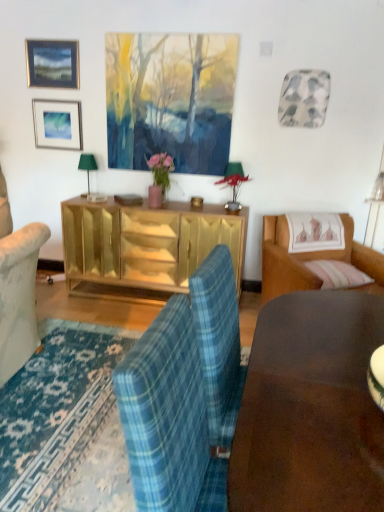
Question: Does matte black picture frame at upper left, the 2th picture frame from the bottom, have a lesser height compared to matte silver picture frame at upper left, marked as the 1th picture frame in a bottom-to-top arrangement?

Choices:
 (A) yes
 (B) no

Answer: (A)

Question: Would you say matte silver picture frame at upper left, marked as the 1th picture frame in a bottom-to-top arrangement, is part of matte black picture frame at upper left, the 2th picture frame from the bottom,'s contents?

Choices:
 (A) no
 (B) yes

Answer: (A)

Question: Does matte black picture frame at upper left, placed as the first picture frame when sorted from top to bottom, appear on the left side of matte silver picture frame at upper left, marked as the 1th picture frame in a bottom-to-top arrangement?

Choices:
 (A) no
 (B) yes

Answer: (A)

Question: Are matte black picture frame at upper left, the 2th picture frame from the bottom, and matte silver picture frame at upper left, placed as the 2th picture frame when sorted from top to bottom, far apart?

Choices:
 (A) no
 (B) yes

Answer: (A)

Question: From the image's perspective, is matte black picture frame at upper left, the 2th picture frame from the bottom, above matte silver picture frame at upper left, placed as the 2th picture frame when sorted from top to bottom?

Choices:
 (A) yes
 (B) no

Answer: (A)

Question: Considering the positions of brown leather couch at right and gold mirrored cabinet at center in the image, is brown leather couch at right bigger or smaller than gold mirrored cabinet at center?

Choices:
 (A) small
 (B) big

Answer: (B)

Question: Is brown leather couch at right taller or shorter than gold mirrored cabinet at center?

Choices:
 (A) tall
 (B) short

Answer: (B)

Question: From a real-world perspective, is brown leather couch at right physically located above or below gold mirrored cabinet at center?

Choices:
 (A) below
 (B) above

Answer: (B)

Question: In terms of width, does brown leather couch at right look wider or thinner when compared to gold mirrored cabinet at center?

Choices:
 (A) thin
 (B) wide

Answer: (B)

Question: Does point (107, 203) appear closer or farther from the camera than point (72, 111)?

Choices:
 (A) farther
 (B) closer

Answer: (B)

Question: Is gold mirrored cabinet at center inside the boundaries of matte silver picture frame at upper left, placed as the 2th picture frame when sorted from top to bottom, or outside?

Choices:
 (A) inside
 (B) outside

Answer: (B)

Question: Is gold mirrored cabinet at center bigger or smaller than matte silver picture frame at upper left, marked as the 1th picture frame in a bottom-to-top arrangement?

Choices:
 (A) big
 (B) small

Answer: (A)

Question: Visually, is gold mirrored cabinet at center positioned to the left or to the right of matte silver picture frame at upper left, placed as the 2th picture frame when sorted from top to bottom?

Choices:
 (A) left
 (B) right

Answer: (B)

Question: Is matte black picture frame at upper left, the 2th picture frame from the bottom, in front of or behind matte silver picture frame at upper left, marked as the 1th picture frame in a bottom-to-top arrangement, in the image?

Choices:
 (A) front
 (B) behind

Answer: (A)

Question: Is matte black picture frame at upper left, placed as the first picture frame when sorted from top to bottom, to the left or to the right of matte silver picture frame at upper left, placed as the 2th picture frame when sorted from top to bottom, in the image?

Choices:
 (A) right
 (B) left

Answer: (A)